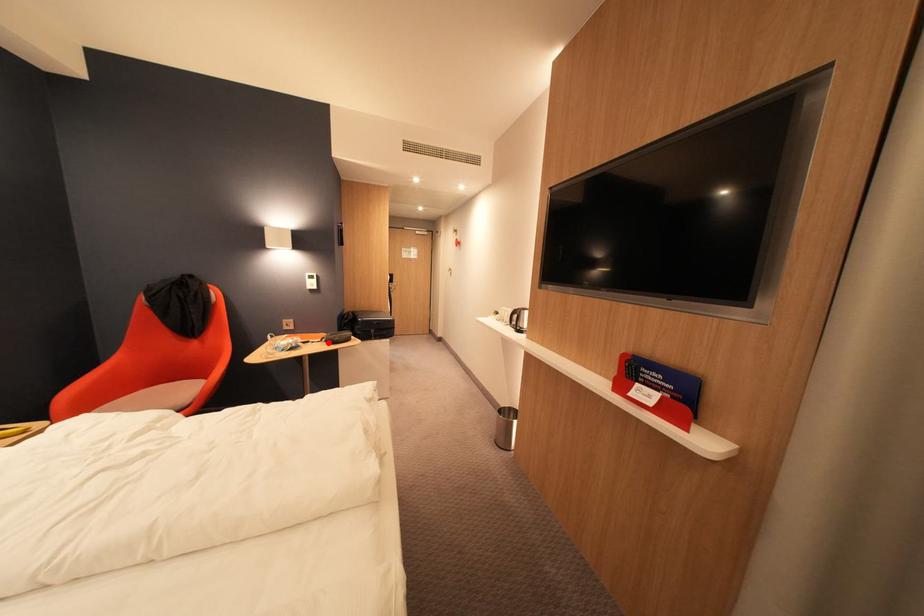
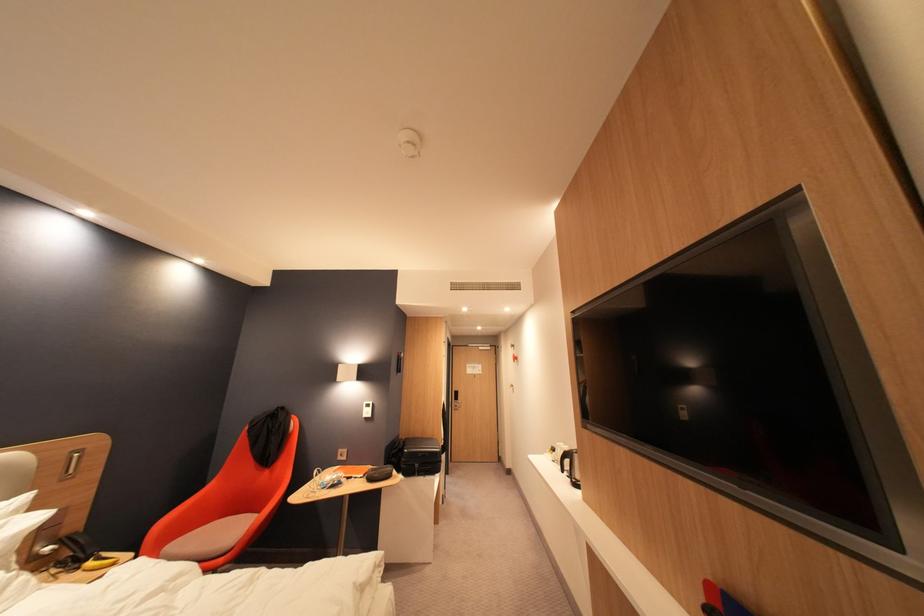
Find the pixel in the second image that matches the highlighted location in the first image.

(371, 477)